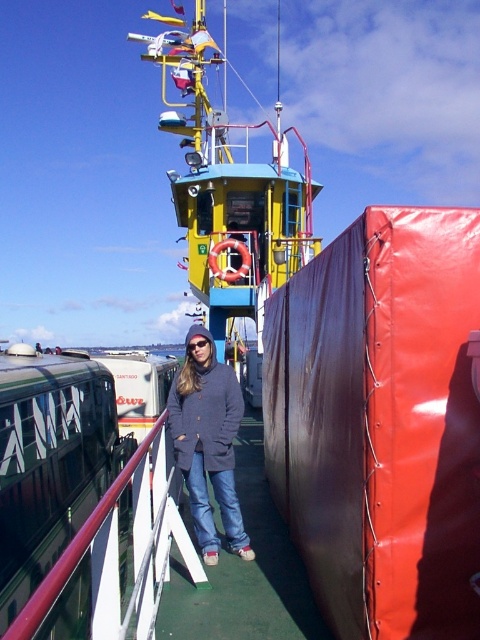
Which is behind, point (171, 413) or point (130, 472)?

Positioned behind is point (171, 413).

Is matte blue jacket at center positioned behind metallic red railing at center?

That is True.

Who is more forward, (236, 504) or (70, 554)?

Point (70, 554) is in front.

Find the location of a particular element. This screenshot has height=640, width=480. matte blue jacket at center is located at coordinates (207, 442).